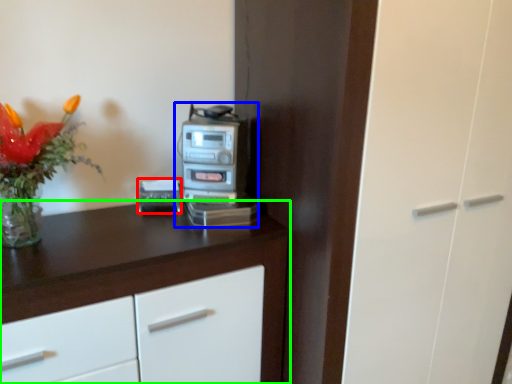
Question: Which is nearer to the appliance (highlighted by a red box)? home appliance (highlighted by a blue box) or cabinetry (highlighted by a green box).

Choices:
 (A) home appliance
 (B) cabinetry

Answer: (A)